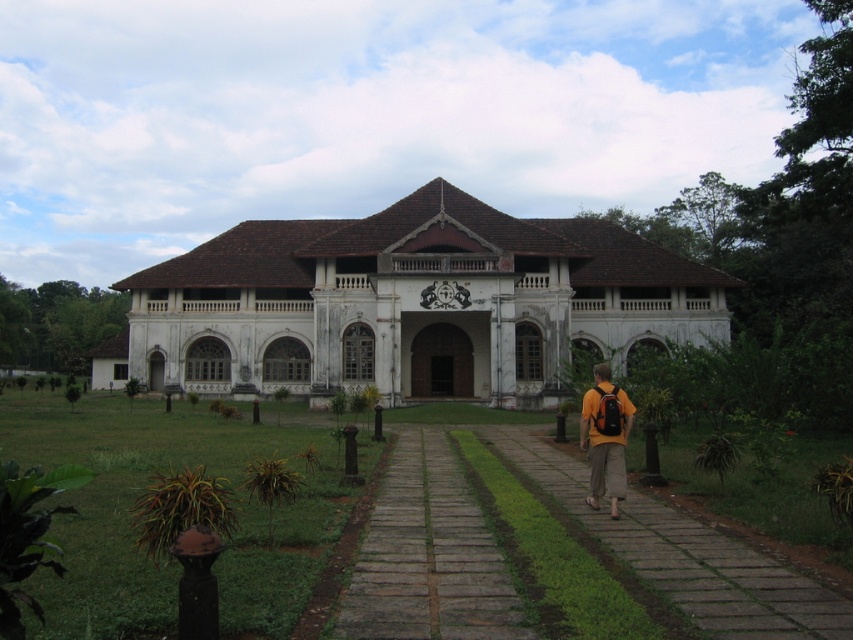
Who is positioned more to the right, white marble mansion at center or brick paved walkway at center?

brick paved walkway at center is more to the right.

Is the position of white marble mansion at center less distant than that of brick paved walkway at center?

No.

Does point (370, 308) come farther from viewer compared to point (677, 566)?

Yes, it is.

Find the location of a particular element. This screenshot has width=853, height=640. white marble mansion at center is located at coordinates (410, 304).

Is gray stone path at center behind orange fabric backpack at center?

No, gray stone path at center is in front of orange fabric backpack at center.

Does gray stone path at center have a greater height compared to orange fabric backpack at center?

No, gray stone path at center is not taller than orange fabric backpack at center.

Who is more distant from viewer, (x=492, y=614) or (x=590, y=472)?

Positioned behind is point (x=590, y=472).

Locate an element on the screen. The height and width of the screenshot is (640, 853). gray stone path at center is located at coordinates (428, 556).

Who is more forward, (405, 506) or (712, 529)?

Point (712, 529)

Which of these two, gray stone path at center or brick paved walkway at center, stands shorter?

Standing shorter between the two is gray stone path at center.

Is point (372, 561) farther from viewer compared to point (801, 588)?

That is True.

I want to click on gray stone path at center, so click(428, 556).